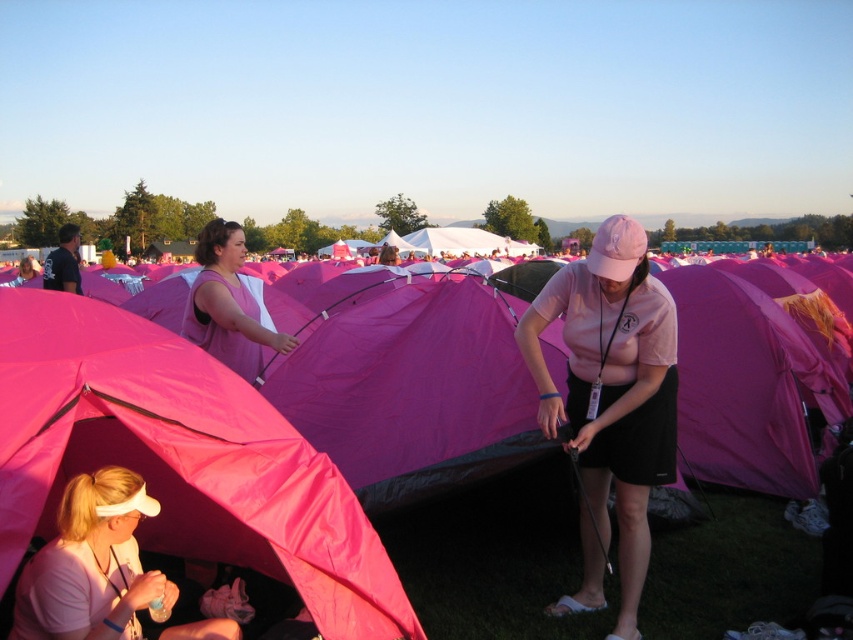
Looking at this image, you are a photographer who needs to set up your camera to capture the pink nylon tent at center. If your camera requires a minimum distance of 10 feet to focus properly, will you be able to focus on the tent from your current position?

The camera and the pink nylon tent at center are 12.61 feet apart, which is more than the required 10 feet. Therefore, you can focus on the pink nylon tent at center from your current position.